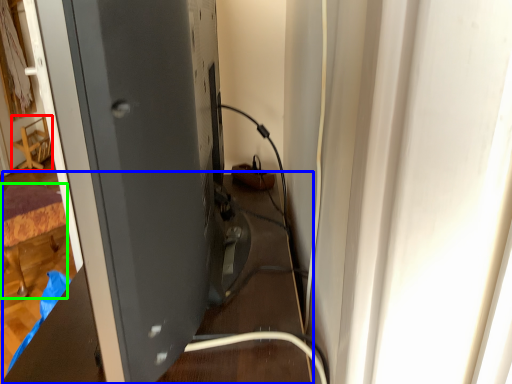
Question: Considering the real-world distances, which object is farthest from furniture (highlighted by a red box)? table (highlighted by a blue box) or furniture (highlighted by a green box)?

Choices:
 (A) table
 (B) furniture

Answer: (A)